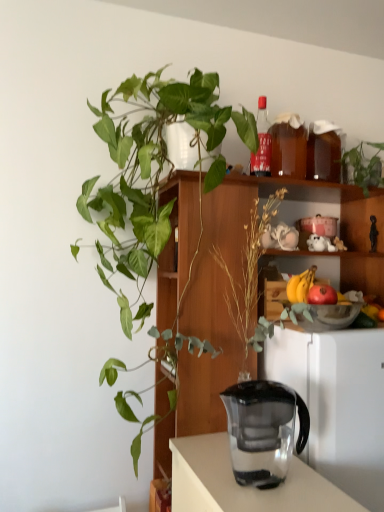
You are a GUI agent. You are given a task and a screenshot of the screen. Output one action in this format:
    pyautogui.click(x=<x>, y=<y>)
    Task: Click on the vacant point above transparent plastic jug at center (from a real-world perspective)
    The height and width of the screenshot is (512, 384).
    Given the screenshot: What is the action you would take?
    pyautogui.click(x=258, y=390)